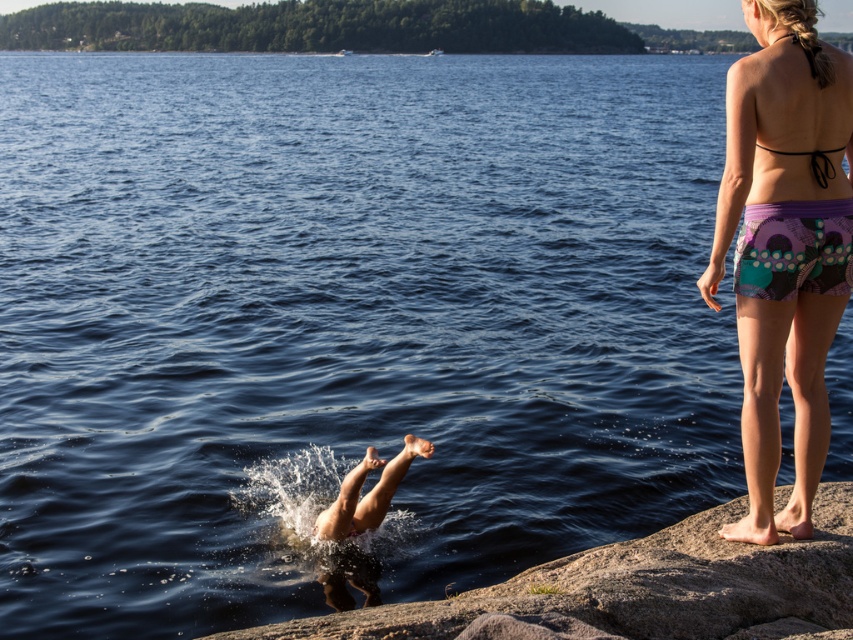
Question: Which point is closer to the camera?

Choices:
 (A) (674, 557)
 (B) (376, 563)

Answer: (A)

Question: Can you confirm if gray granite rock at lower center is positioned to the left of smooth skin person at center?

Choices:
 (A) yes
 (B) no

Answer: (B)

Question: Among these points, which one is farthest from the camera?

Choices:
 (A) [419, 604]
 (B) [775, 202]

Answer: (B)

Question: In this image, where is purple printed shorts at right located relative to gray granite rock at lower center?

Choices:
 (A) right
 (B) left

Answer: (A)

Question: Is purple printed shorts at right to the left of gray granite rock at lower center from the viewer's perspective?

Choices:
 (A) no
 (B) yes

Answer: (A)

Question: Which of the following is the closest to the observer?

Choices:
 (A) purple printed shorts at right
 (B) gray granite rock at lower center
 (C) smooth skin person at center

Answer: (B)